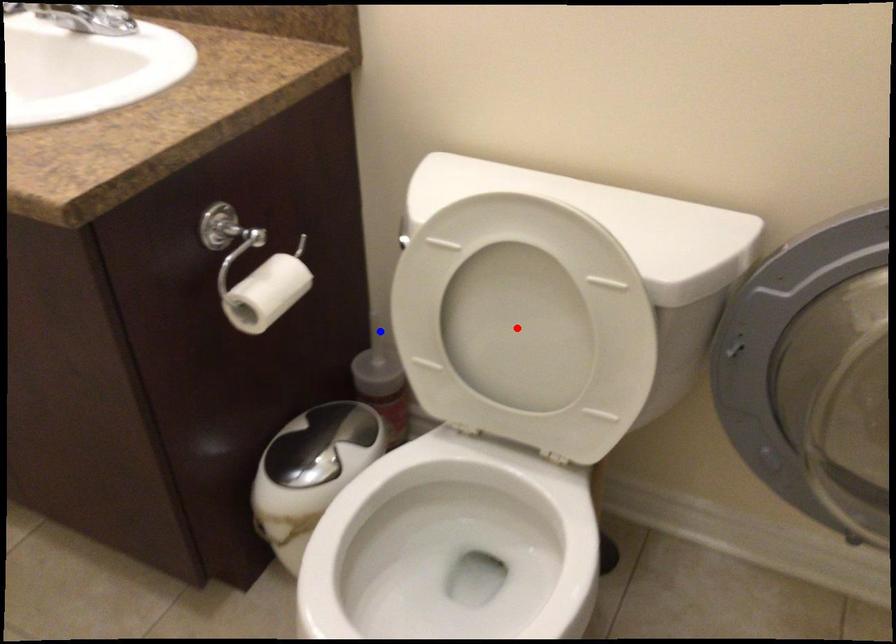
Question: Two points are marked on the image. Which point is closer to the camera?

Choices:
 (A) Blue point is closer.
 (B) Red point is closer.

Answer: (B)